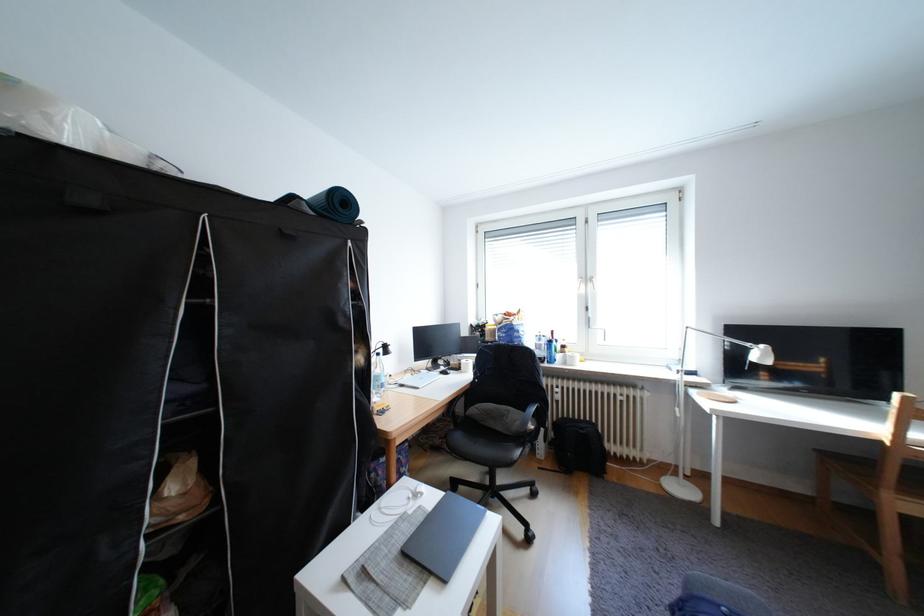
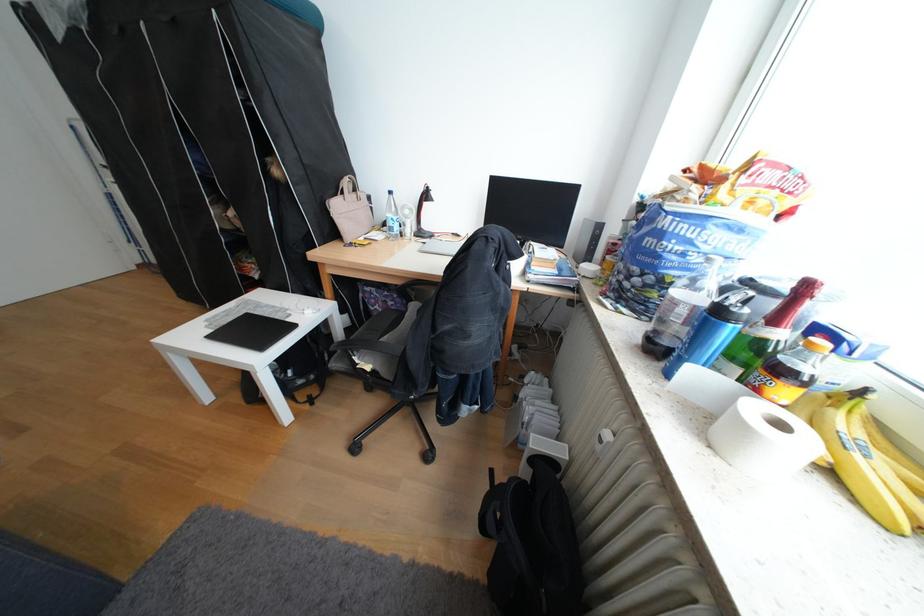
Where in the second image is the point corresponding to point (565, 333) from the first image?

(819, 288)